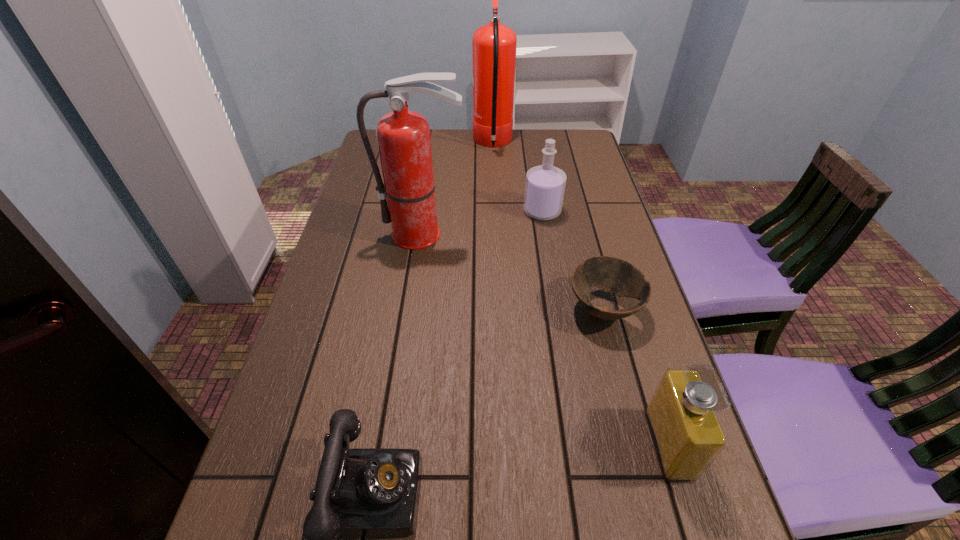
Image resolution: width=960 pixels, height=540 pixels. What are the coordinates of `free space located 0.180m with the handle and hose on the nearer fire extinguisher` in the screenshot? It's located at (414, 300).

Where is `vacant space located on the front of the farther perfume`? The height and width of the screenshot is (540, 960). vacant space located on the front of the farther perfume is located at coordinates (549, 255).

The height and width of the screenshot is (540, 960). What are the coordinates of `vacant region located on the front-facing side of the right perfume` in the screenshot? It's located at (473, 444).

Find the location of a particular element. blank space located 0.190m on the front-facing side of the right perfume is located at coordinates (549, 444).

This screenshot has height=540, width=960. I want to click on vacant area situated 0.120m on the front-facing side of the right perfume, so click(x=588, y=444).

Locate an element on the screen. This screenshot has width=960, height=540. free space located 0.350m on the left of the shortest object is located at coordinates pos(419,309).

This screenshot has width=960, height=540. What are the coordinates of `object positioned at the far edge` in the screenshot? It's located at (494, 45).

Where is `object that is at the left edge`? Image resolution: width=960 pixels, height=540 pixels. object that is at the left edge is located at coordinates (403, 137).

Locate an element on the screen. This screenshot has height=540, width=960. bowl at the right edge is located at coordinates (616, 276).

Locate an element on the screen. The height and width of the screenshot is (540, 960). vacant space at the far edge of the desktop is located at coordinates click(455, 152).